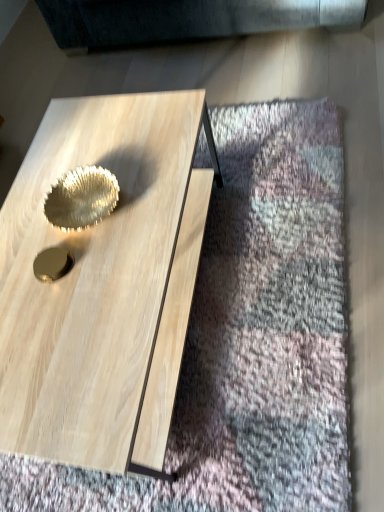
Measure the distance between shiny metallic bowl at center and camera.

They are 3.52 feet apart.

This screenshot has height=512, width=384. Identify the location of shiny metallic bowl at center. (81, 198).

What do you see at coordinates (81, 198) in the screenshot? The height and width of the screenshot is (512, 384). I see `shiny metallic bowl at center` at bounding box center [81, 198].

In order to face natural wood coffee table at center, should I rotate leftwards or rightwards?

Rotate left and turn 11.658 degrees.

Measure the distance between natural wood coffee table at center and camera.

The depth of natural wood coffee table at center is 30.32 inches.

Describe the element at coordinates (103, 284) in the screenshot. I see `natural wood coffee table at center` at that location.

Locate an element on the screen. The width and height of the screenshot is (384, 512). natural wood coffee table at center is located at coordinates (103, 284).

Find the location of a particular element. The height and width of the screenshot is (512, 384). shiny metallic bowl at center is located at coordinates (81, 198).

Can you confirm if shiny metallic bowl at center is positioned to the left of natural wood coffee table at center?

Yes, shiny metallic bowl at center is to the left of natural wood coffee table at center.

Which object is more forward, shiny metallic bowl at center or natural wood coffee table at center?

natural wood coffee table at center is more forward.

Is point (67, 192) closer to camera compared to point (80, 164)?

Yes.

From the image's perspective, between shiny metallic bowl at center and natural wood coffee table at center, who is located below?

natural wood coffee table at center appears lower in the image.

From a real-world perspective, is shiny metallic bowl at center over natural wood coffee table at center?

Correct, in the physical world, shiny metallic bowl at center is higher than natural wood coffee table at center.

Is shiny metallic bowl at center wider than natural wood coffee table at center?

Incorrect, the width of shiny metallic bowl at center does not surpass that of natural wood coffee table at center.

In terms of height, does shiny metallic bowl at center look taller or shorter compared to natural wood coffee table at center?

Clearly, shiny metallic bowl at center is shorter compared to natural wood coffee table at center.

Can you confirm if shiny metallic bowl at center is bigger than natural wood coffee table at center?

No.

Would you say shiny metallic bowl at center is outside natural wood coffee table at center?

No, shiny metallic bowl at center is inside or overlapping with natural wood coffee table at center.

Is shiny metallic bowl at center directly adjacent to natural wood coffee table at center?

shiny metallic bowl at center and natural wood coffee table at center are clearly separated.

Could you tell me if shiny metallic bowl at center is facing natural wood coffee table at center?

No, shiny metallic bowl at center is not facing towards natural wood coffee table at center.

How different are the orientations of shiny metallic bowl at center and natural wood coffee table at center in degrees?

The angular difference between shiny metallic bowl at center and natural wood coffee table at center is 0.93 degrees.

Consider the image. Measure the distance between shiny metallic bowl at center and natural wood coffee table at center.

shiny metallic bowl at center and natural wood coffee table at center are 6.99 inches apart from each other.

Identify the location of gold that is above the natural wood coffee table at center (from a real-world perspective). (x=81, y=198).

In the scene shown: Between natural wood coffee table at center and shiny metallic bowl at center, which one appears on the left side from the viewer's perspective?

Positioned to the left is shiny metallic bowl at center.

Relative to shiny metallic bowl at center, is natural wood coffee table at center in front or behind?

In the image, natural wood coffee table at center appears in front of shiny metallic bowl at center.

Does point (48, 174) come closer to viewer compared to point (107, 199)?

No.

From the image's perspective, is natural wood coffee table at center located above or below shiny metallic bowl at center?

From the image's perspective, natural wood coffee table at center appears below shiny metallic bowl at center.

From a real-world perspective, is natural wood coffee table at center beneath shiny metallic bowl at center?

Yes, from a real-world perspective, natural wood coffee table at center is under shiny metallic bowl at center.

Considering the sizes of objects natural wood coffee table at center and shiny metallic bowl at center in the image provided, who is wider, natural wood coffee table at center or shiny metallic bowl at center?

natural wood coffee table at center is wider.

Is natural wood coffee table at center taller or shorter than shiny metallic bowl at center?

Clearly, natural wood coffee table at center is taller compared to shiny metallic bowl at center.

Who is smaller, natural wood coffee table at center or shiny metallic bowl at center?

shiny metallic bowl at center.

Would you say natural wood coffee table at center is inside or outside shiny metallic bowl at center?

The correct answer is: outside.

Is natural wood coffee table at center not close to shiny metallic bowl at center?

That's not correct — natural wood coffee table at center is a little close to shiny metallic bowl at center.

Is natural wood coffee table at center oriented away from shiny metallic bowl at center?

No, natural wood coffee table at center is not facing away from shiny metallic bowl at center.

How much distance is there between natural wood coffee table at center and shiny metallic bowl at center?

They are 6.99 inches apart.

Find the location of a particular element. gold lying behind the natural wood coffee table at center is located at coordinates (81, 198).

The width and height of the screenshot is (384, 512). I want to click on gold behind the natural wood coffee table at center, so click(x=81, y=198).

Locate an element on the screen. coffee table below the shiny metallic bowl at center (from a real-world perspective) is located at coordinates (103, 284).